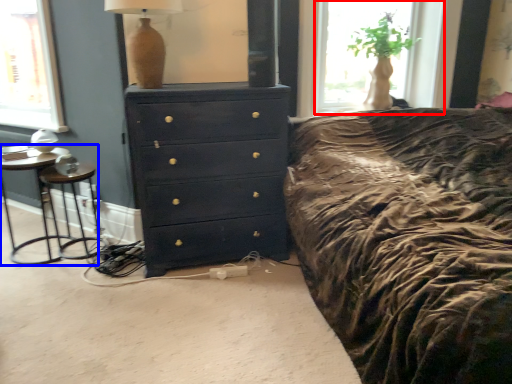
Question: Which object appears closest to the camera in this image, window (highlighted by a red box) or nightstand (highlighted by a blue box)?

Choices:
 (A) window
 (B) nightstand

Answer: (B)